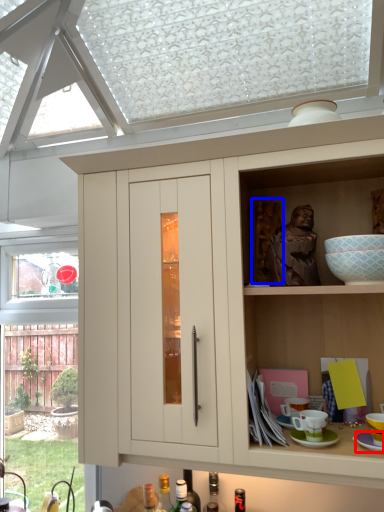
Question: Which of the following is the closest to the observer, saucer (highlighted by a red box) or sculpture (highlighted by a blue box)?

Choices:
 (A) saucer
 (B) sculpture

Answer: (A)